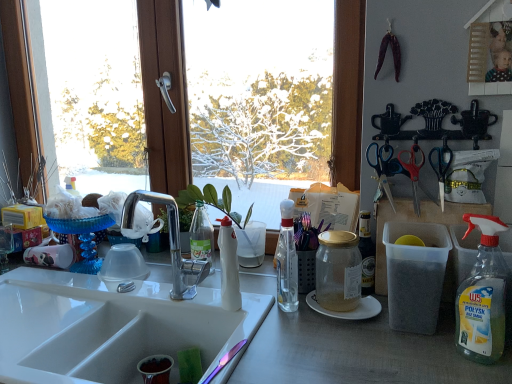
Locate an element on the screen. vacant region in front of clear glass bottle at center, acting as the third bottle starting from the right is located at coordinates (296, 337).